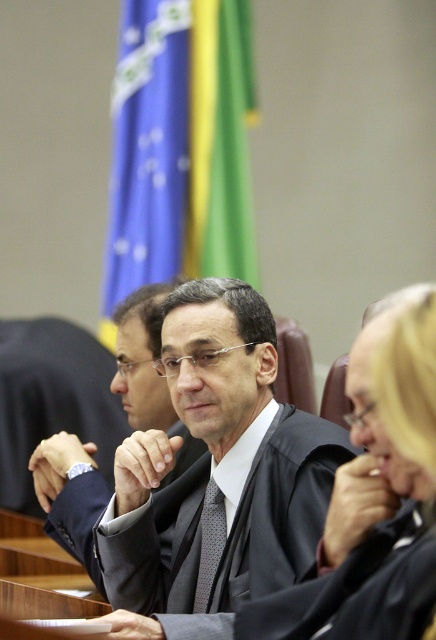
You are an assistant helping to prepare for a formal event. You see the smooth black robe at center and the black textured tie at center. Which item is covering the other one?

The smooth black robe at center is positioned over the black textured tie at center, so the robe is covering the tie.

You are an observer in the courtroom and need to determine which item is nearer to you between the smooth black robe at center and the black matte suit at center. Based on their positions, which one is closer?

The smooth black robe at center is closer to the viewer than the black matte suit at center, so the smooth black robe at center is nearer.

You are a photographer in the courtroom. You need to adjust your camera focus to capture both the smooth black robe at center and the black textured tie at center clearly. Since they are at different distances, which one should you focus on first to ensure the foreground object is sharp?

The smooth black robe at center is in front of the black textured tie at center, so you should focus on the smooth black robe at center first to ensure the foreground object is sharp.